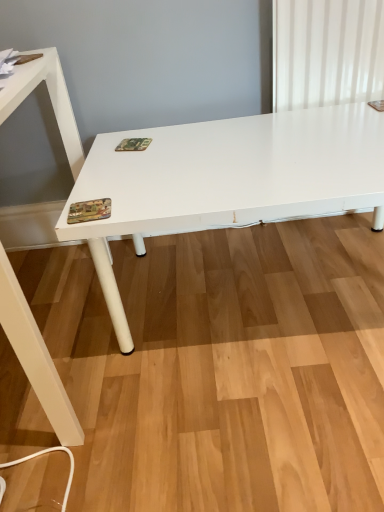
Where is `white matte desk at left`? Image resolution: width=384 pixels, height=512 pixels. white matte desk at left is located at coordinates click(35, 356).

Describe the element at coordinates (35, 356) in the screenshot. The image size is (384, 512). I see `white matte desk at left` at that location.

Where is `white matte desk at left`? Image resolution: width=384 pixels, height=512 pixels. white matte desk at left is located at coordinates (35, 356).